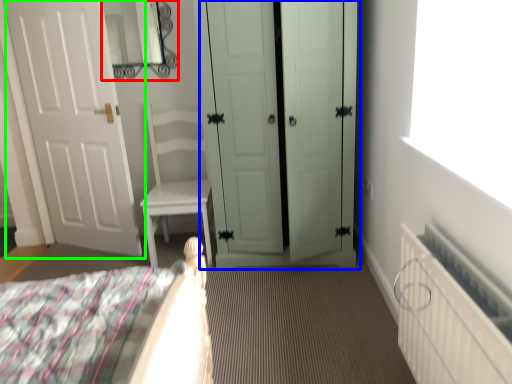
Question: Estimate the real-world distances between objects in this image. Which object is closer to mirror (highlighted by a red box), door (highlighted by a blue box) or door (highlighted by a green box)?

Choices:
 (A) door
 (B) door

Answer: (B)